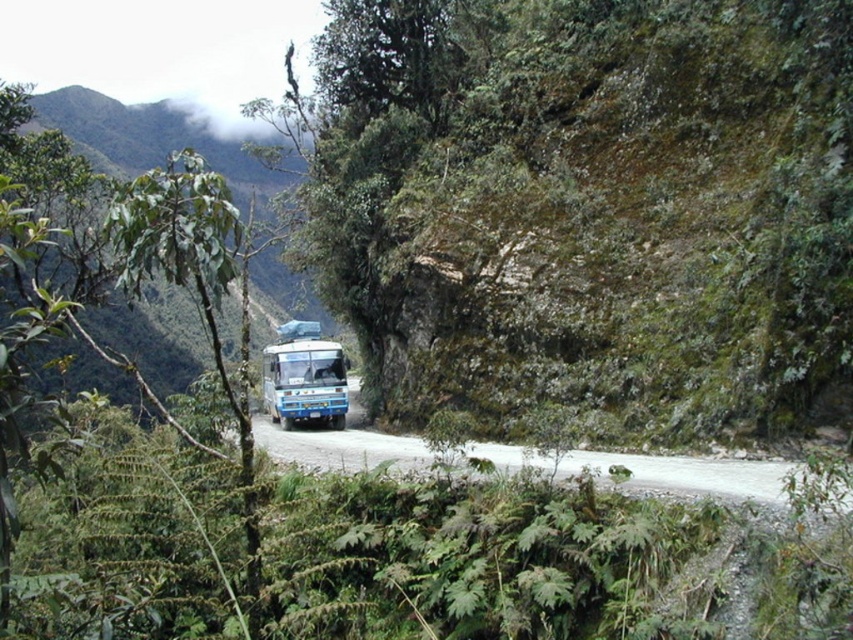
You are a passenger on the blue matte bus at center and want to know which direction the bus is facing relative to the green leafy mountain at center. Is the mountain to the left or right of the bus?

The green leafy mountain at center is to the left of the blue matte bus at center, so the mountain is on the left side of the bus.

You are a driver of the blue matte bus at center. You want to pass through a narrow section of the road where the green leafy tree at center is growing. Can you safely navigate through without hitting the tree?

The green leafy tree at center might be wider than the blue matte bus at center, so there is a possibility that the bus may not fit through the narrow section if the tree is indeed wider. The driver should proceed with caution and assess the actual width on site.